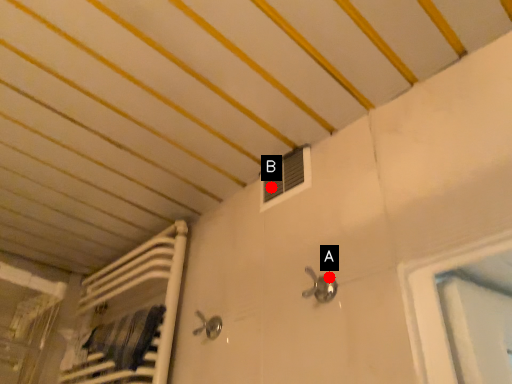
Question: Two points are circled on the image, labeled by A and B beside each circle. Which point is closer to the camera?

Choices:
 (A) A is closer
 (B) B is closer

Answer: (A)